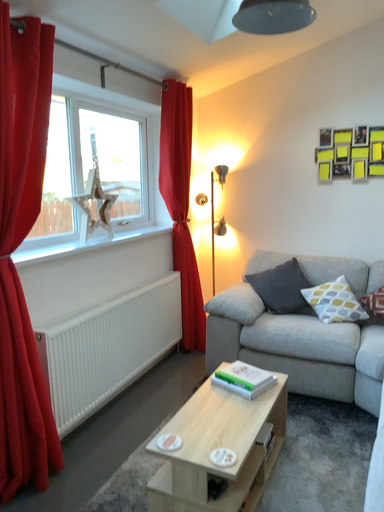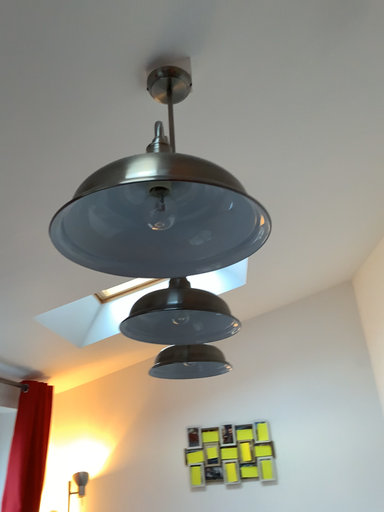
Question: Which way did the camera rotate in the video?

Choices:
 (A) rotated right
 (B) rotated left

Answer: (A)